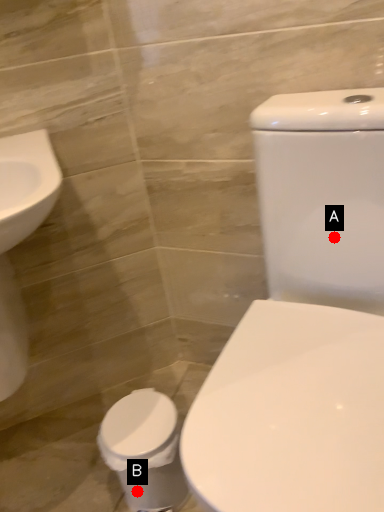
Question: Two points are circled on the image, labeled by A and B beside each circle. Which point appears farthest from the camera in this image?

Choices:
 (A) A is further
 (B) B is further

Answer: (B)